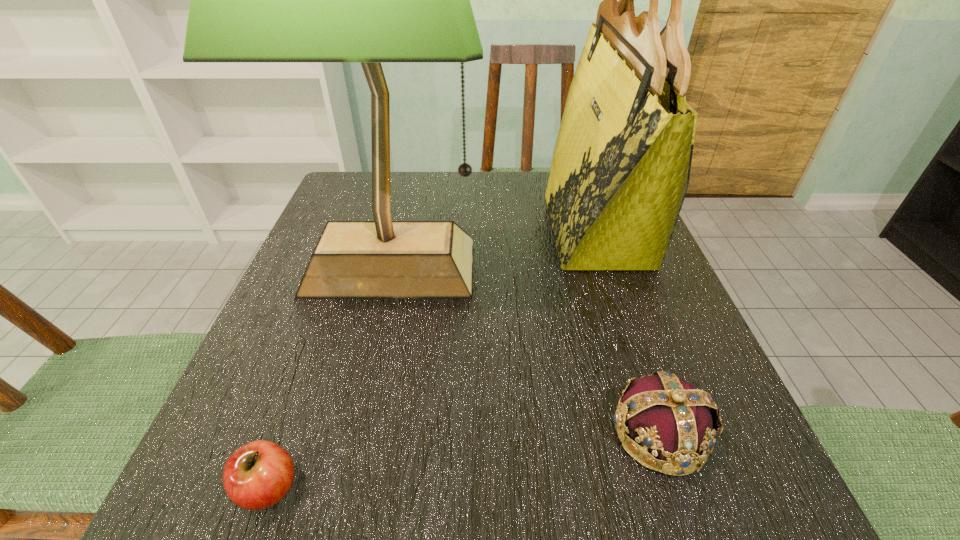
The width and height of the screenshot is (960, 540). I want to click on vacant space at the far edge, so click(x=504, y=221).

Identify the location of vacant space at the near edge of the desktop. (444, 514).

Find the location of a particular element. The image size is (960, 540). vacant space at the left edge of the desktop is located at coordinates (342, 391).

Where is `vacant space at the right edge of the desktop`? vacant space at the right edge of the desktop is located at coordinates (650, 270).

Identify the location of vacant space at the far left corner of the desktop. This screenshot has height=540, width=960. (367, 219).

This screenshot has height=540, width=960. In the image, there is a desktop. Identify the location of free space at the near right corner. (762, 478).

This screenshot has height=540, width=960. I want to click on vacant space that is in between the table lamp and the shortest object, so click(329, 377).

At what (x,y) coordinates should I click in order to perform the action: click on vacant region between the table lamp and the tote bag. Please return your answer as a coordinate pair (x, y). Looking at the image, I should click on (493, 248).

Locate an element on the screen. This screenshot has width=960, height=540. vacant point located between the shortest object and the table lamp is located at coordinates (329, 377).

The height and width of the screenshot is (540, 960). I want to click on vacant space that is in between the table lamp and the tote bag, so pyautogui.click(x=493, y=248).